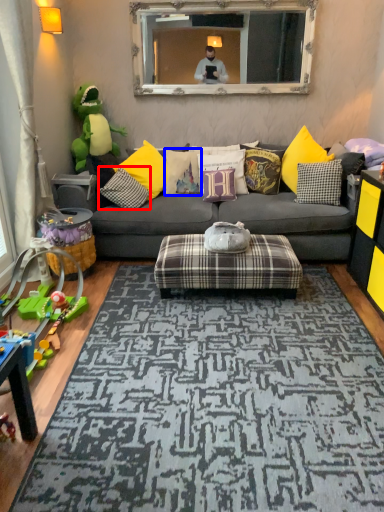
Question: Among these objects, which one is nearest to the camera, pillow (highlighted by a red box) or pillow (highlighted by a blue box)?

Choices:
 (A) pillow
 (B) pillow

Answer: (A)